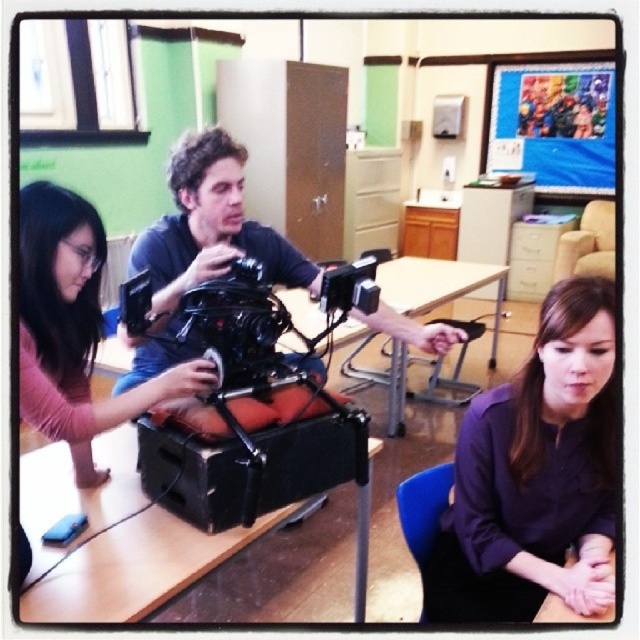
Question: Is black plastic table at center further to camera compared to wooden table at lower center?

Choices:
 (A) yes
 (B) no

Answer: (B)

Question: Estimate the real-world distances between objects in this image. Which object is farther from the wooden table at lower center?

Choices:
 (A) purple matte shirt at lower right
 (B) wooden table at center

Answer: (B)

Question: Which point appears farthest from the camera in this image?

Choices:
 (A) (566, 612)
 (B) (76, 387)

Answer: (B)

Question: Which object appears farthest from the camera in this image?

Choices:
 (A) wooden table at lower center
 (B) black plastic table at center
 (C) wooden table at center
 (D) purple matte shirt at lower right

Answer: (C)

Question: Can you confirm if matte pink shirt at left is bigger than wooden table at center?

Choices:
 (A) yes
 (B) no

Answer: (B)

Question: Considering the relative positions of black plastic table at center and matte pink shirt at left in the image provided, where is black plastic table at center located with respect to matte pink shirt at left?

Choices:
 (A) above
 (B) below

Answer: (B)